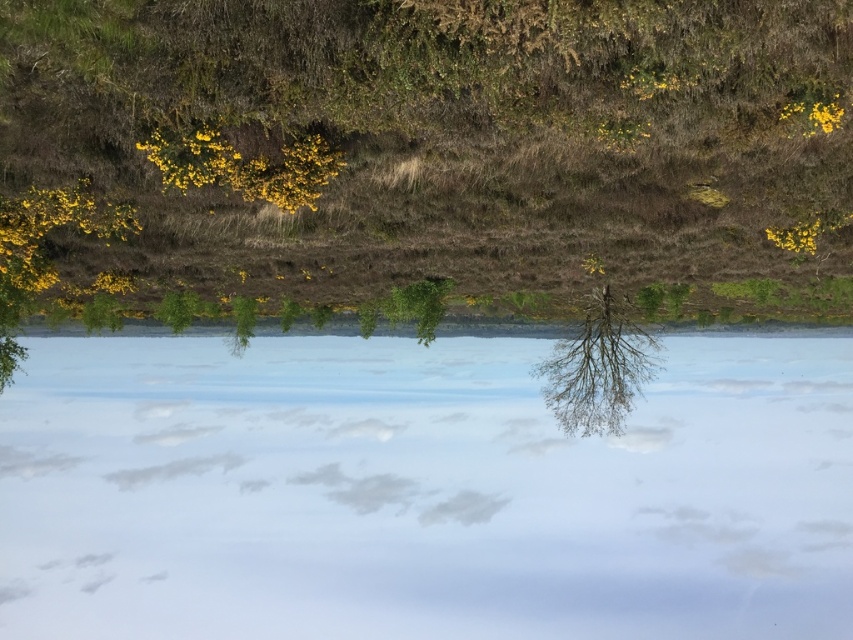
Question: Is transparent glass water at center to the right of bare branches tree at center from the viewer's perspective?

Choices:
 (A) yes
 (B) no

Answer: (B)

Question: Can you confirm if transparent glass water at center is bigger than bare branches tree at center?

Choices:
 (A) no
 (B) yes

Answer: (B)

Question: Which point appears closest to the camera in this image?

Choices:
 (A) (619, 394)
 (B) (154, 600)

Answer: (A)

Question: Is transparent glass water at center to the right of bare branches tree at center from the viewer's perspective?

Choices:
 (A) yes
 (B) no

Answer: (B)

Question: Which point is farther from the camera taking this photo?

Choices:
 (A) (585, 365)
 (B) (164, 435)

Answer: (B)